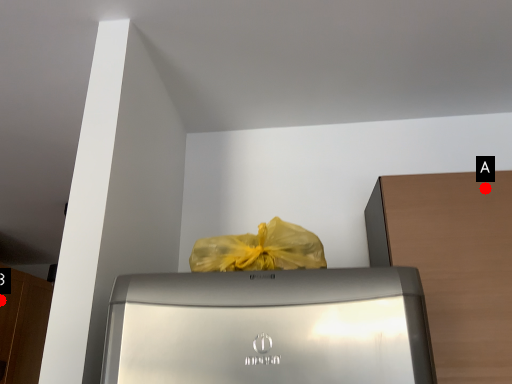
Question: Two points are circled on the image, labeled by A and B beside each circle. Which point is closer to the camera?

Choices:
 (A) A is closer
 (B) B is closer

Answer: (A)